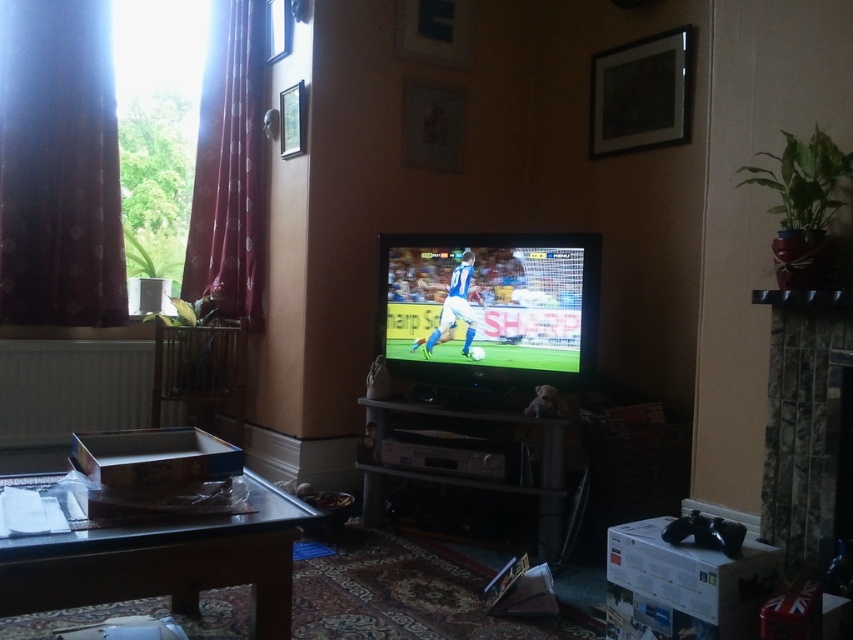
Question: Does wooden table at lower left have a lesser width compared to marble fireplace at right?

Choices:
 (A) no
 (B) yes

Answer: (A)

Question: Estimate the real-world distances between objects in this image. Which object is farther from the dark red velvet curtain at left?

Choices:
 (A) clear glass window at upper center
 (B) wooden table at lower left

Answer: (B)

Question: Which object appears farthest from the camera in this image?

Choices:
 (A) clear glass window at upper center
 (B) dark red velvet curtain at left
 (C) wooden table at lower left

Answer: (A)

Question: Which of these objects is positioned farthest from the wooden table at lower left?

Choices:
 (A) clear glass window at upper center
 (B) dark red velvet curtain at left
 (C) marble fireplace at right
 (D) velvet red curtain at left

Answer: (A)

Question: Does dark red velvet curtain at left appear on the right side of wooden table at lower left?

Choices:
 (A) yes
 (B) no

Answer: (B)

Question: Can you confirm if velvet red curtain at left is positioned to the right of clear glass window at upper center?

Choices:
 (A) yes
 (B) no

Answer: (B)